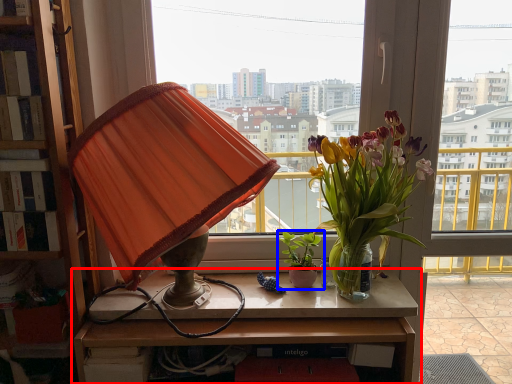
Question: Which object is closer to the camera taking this photo, table (highlighted by a red box) or houseplant (highlighted by a blue box)?

Choices:
 (A) table
 (B) houseplant

Answer: (A)